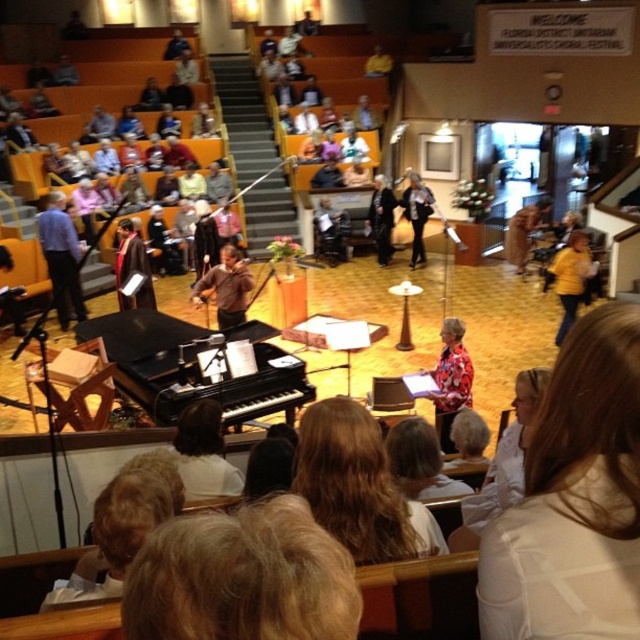
Question: Does white fabric shirt at lower right appear on the left side of black polished piano at center?

Choices:
 (A) no
 (B) yes

Answer: (A)

Question: From the image, what is the correct spatial relationship of white fabric shirt at lower right in relation to matte blue shirt at left?

Choices:
 (A) above
 (B) below

Answer: (B)

Question: Estimate the real-world distances between objects in this image. Which object is farther from the black polished piano at center?

Choices:
 (A) white fabric shirt at lower right
 (B) matte blue shirt at left
 (C) blonde hair at center

Answer: (A)

Question: Does blonde hair at center appear on the left side of matte blue shirt at left?

Choices:
 (A) no
 (B) yes

Answer: (A)

Question: Which of the following is the closest to the observer?

Choices:
 (A) (624, 618)
 (B) (61, 212)
 (C) (413, 544)

Answer: (A)

Question: Which object is closer to the camera taking this photo?

Choices:
 (A) black polished piano at center
 (B) matte blue shirt at left

Answer: (A)